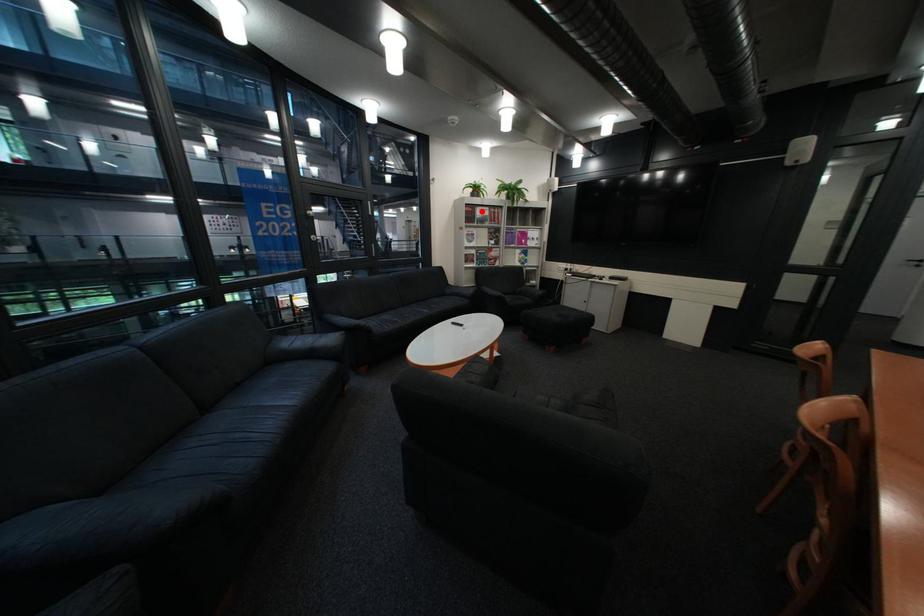
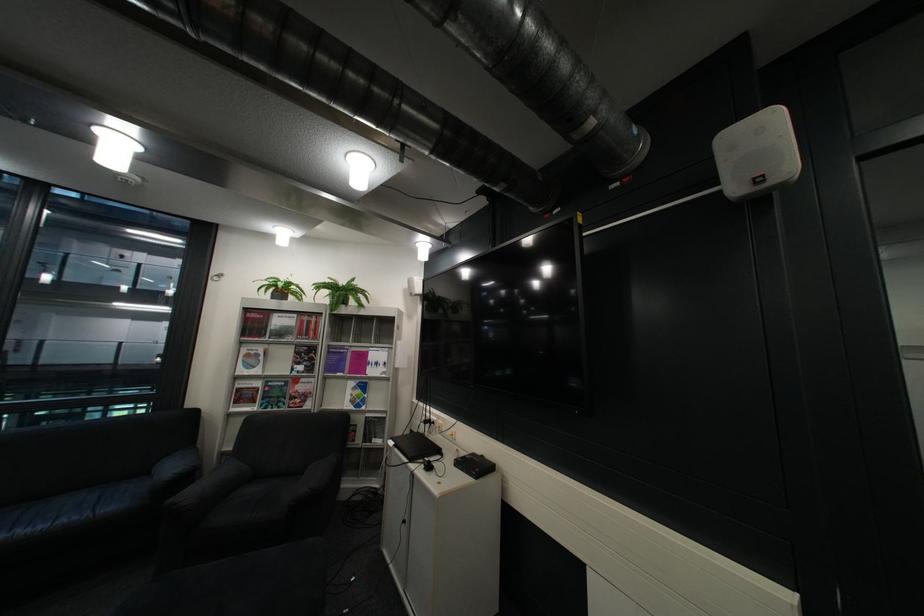
Question: I am providing you with two images of the same scene from different viewpoints. Given a red point in image1, look at the same physical point in image2. Is it:

Choices:
 (A) Closer to the viewpoint
 (B) Farther from the viewpoint

Answer: (B)